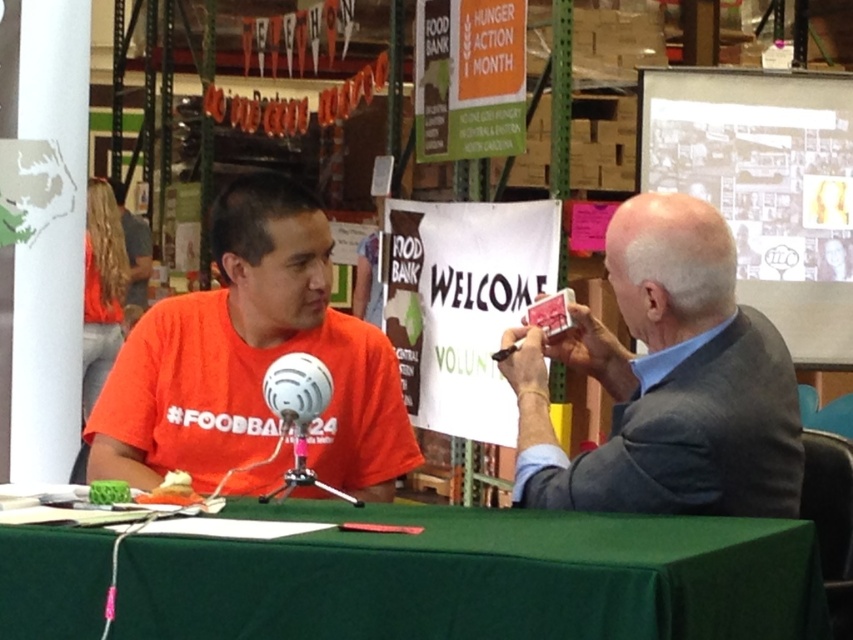
Question: Is gray fabric suit at right positioned at the back of white matte microphone at center?

Choices:
 (A) no
 (B) yes

Answer: (A)

Question: Can you confirm if gray fabric suit at right is bigger than white matte microphone at center?

Choices:
 (A) yes
 (B) no

Answer: (A)

Question: Estimate the real-world distances between objects in this image. Which object is farther from the orange matte shirt at center?

Choices:
 (A) green fabric table at center
 (B) white matte microphone at center

Answer: (A)

Question: Which of the following is the farthest from the observer?

Choices:
 (A) (728, 369)
 (B) (345, 333)
 (C) (297, 368)
 (D) (531, 630)

Answer: (B)

Question: Does gray fabric suit at right have a larger size compared to white matte microphone at center?

Choices:
 (A) no
 (B) yes

Answer: (B)

Question: Which point is closer to the camera taking this photo?

Choices:
 (A) 183,442
 (B) 650,598
 (C) 664,346
 (D) 344,496

Answer: (B)